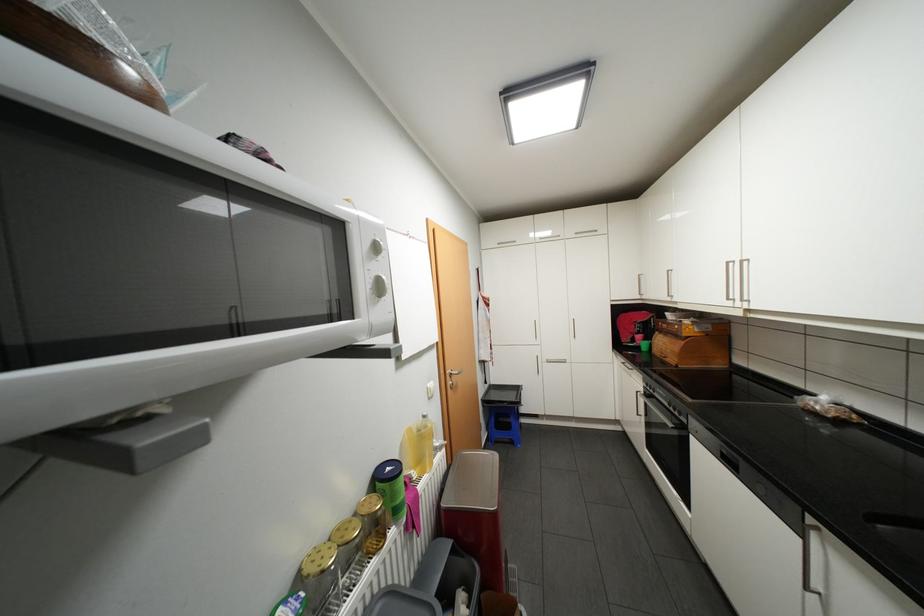
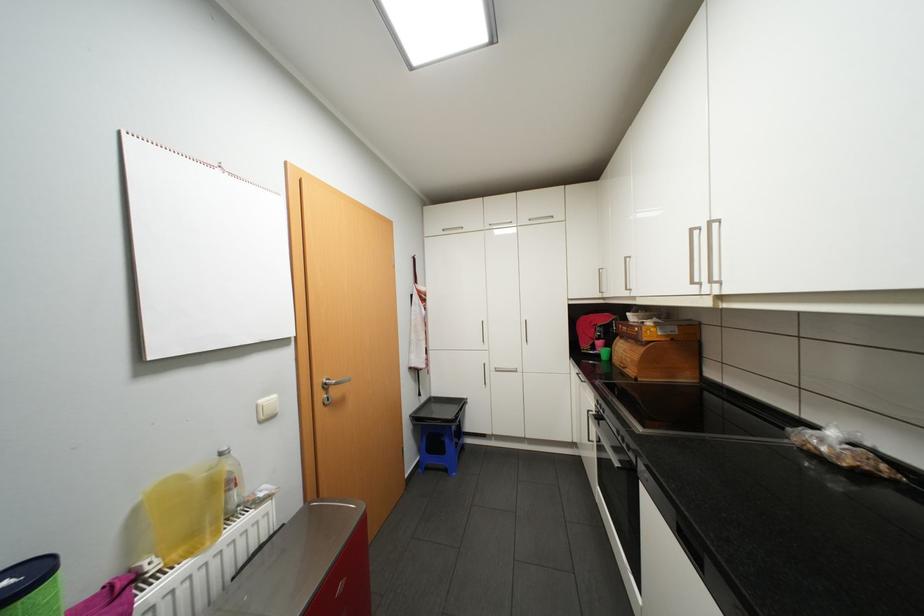
In a continuous first-person perspective shot, in which direction is the camera moving?

The movement direction of the cameraman is right, forward.